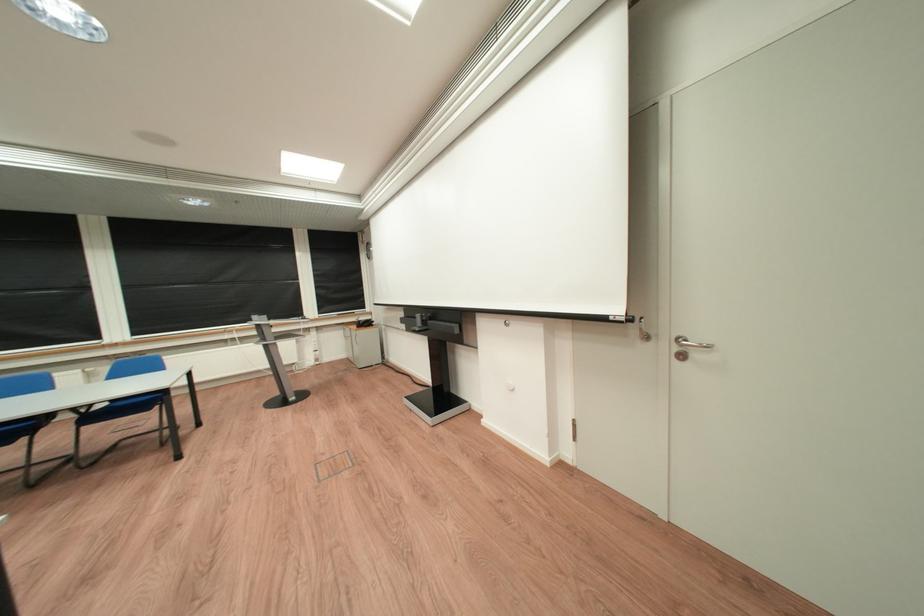
At what (x,y) coordinates should I click in order to perform the action: click on blue chair sitting surface. Please return your answer as a coordinate pair (x, y). Looking at the image, I should click on (15, 435).